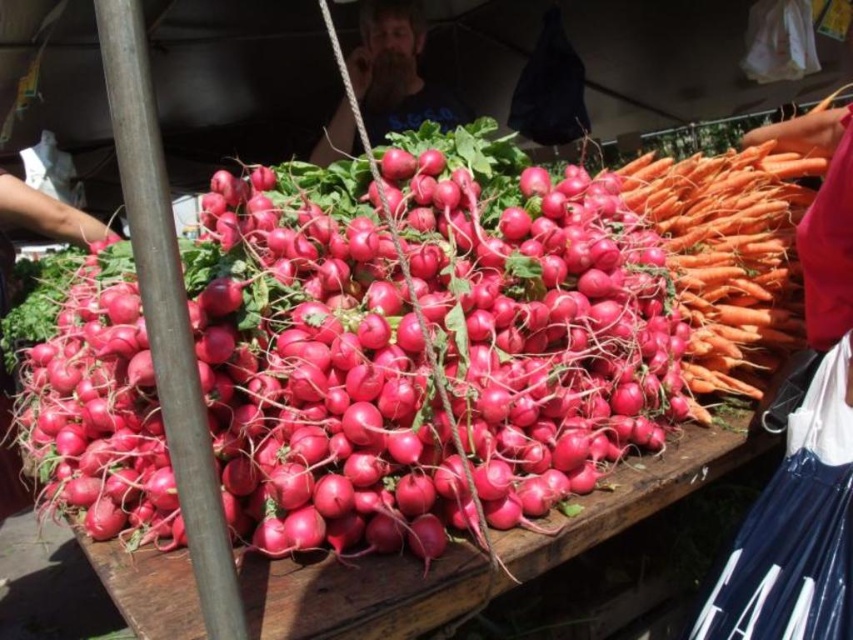
Question: Which point is closer to the camera taking this photo?

Choices:
 (A) (784, 236)
 (B) (318, 140)

Answer: (A)

Question: Which point appears closest to the camera in this image?

Choices:
 (A) (743, 179)
 (B) (381, 140)

Answer: (A)

Question: Is orange smooth carrot at right bigger than bearded man at center?

Choices:
 (A) no
 (B) yes

Answer: (A)

Question: Is orange smooth carrot at right positioned at the back of bearded man at center?

Choices:
 (A) yes
 (B) no

Answer: (B)

Question: Where is orange smooth carrot at right located in relation to bearded man at center in the image?

Choices:
 (A) below
 (B) above

Answer: (A)